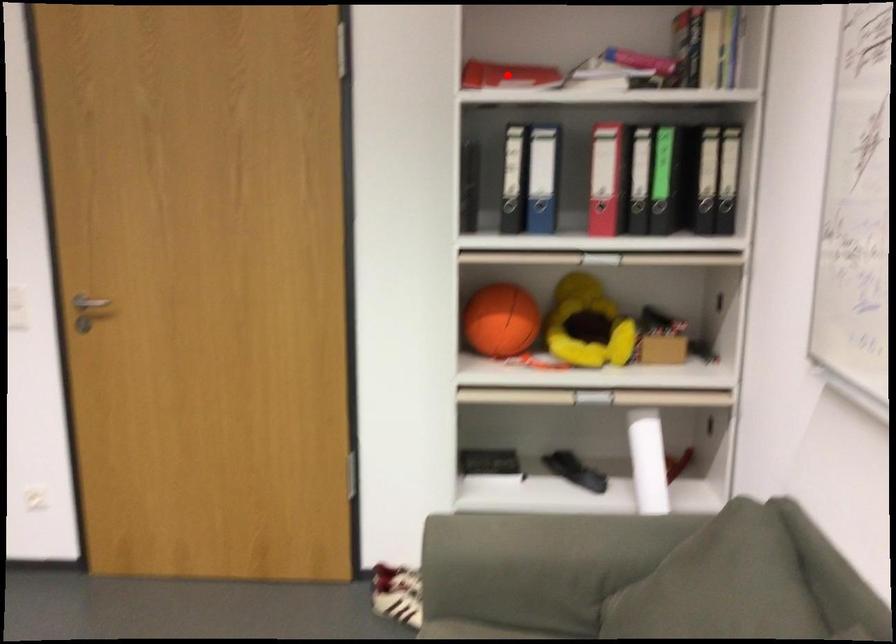
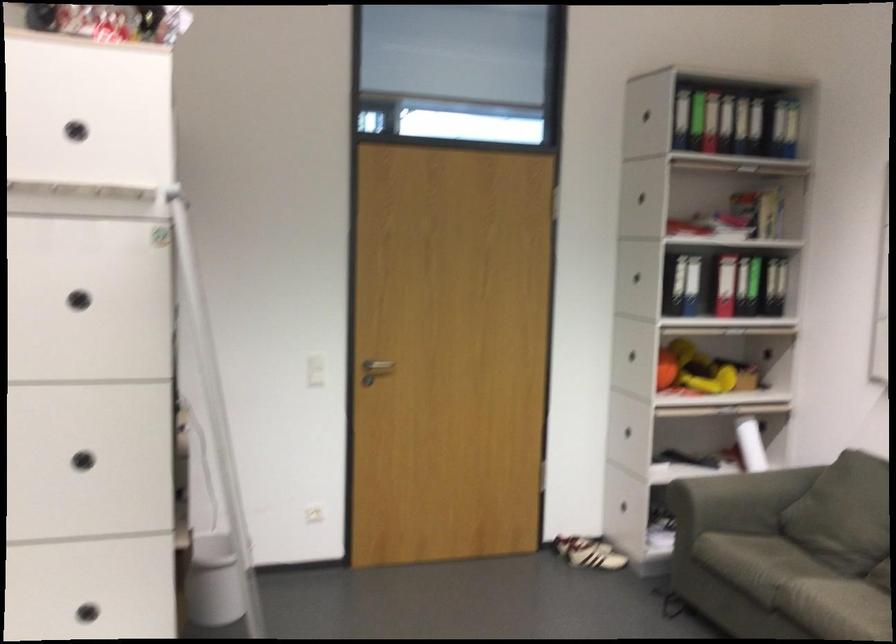
Question: I am providing you with two images of the same scene from different viewpoints. A red point is marked on the first image. At the location where the point appears in image 1, is it still visible in image 2?

Choices:
 (A) Yes
 (B) No

Answer: (B)